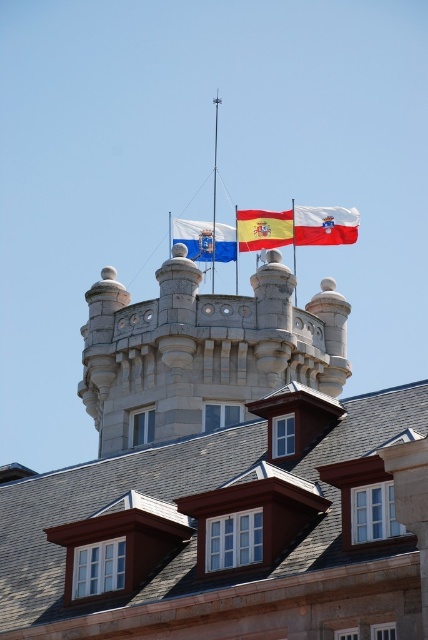
Can you confirm if blue fabric flag at center is taller than red fabric flag at upper center?

No, blue fabric flag at center is not taller than red fabric flag at upper center.

Can you confirm if blue fabric flag at center is positioned to the right of red fabric flag at upper center?

In fact, blue fabric flag at center is to the left of red fabric flag at upper center.

Does point (202, 257) lie behind point (267, 221)?

No, it is in front of (267, 221).

Image resolution: width=428 pixels, height=640 pixels. Identify the location of blue fabric flag at center. (205, 240).

Can you confirm if red fabric flag at upper center is thinner than metallic flagpole at upper center?

In fact, red fabric flag at upper center might be wider than metallic flagpole at upper center.

Who is more forward, (290, 214) or (213, 241)?

Point (213, 241)

Identify the location of red fabric flag at upper center. The image size is (428, 640). pyautogui.click(x=264, y=228).

Is point (333, 243) positioned after point (202, 228)?

That is True.

Does red fabric flag at center have a smaller size compared to blue fabric flag at center?

Incorrect, red fabric flag at center is not smaller in size than blue fabric flag at center.

Does point (323, 209) come behind point (210, 240)?

That is True.

Identify the location of red fabric flag at center. (324, 225).